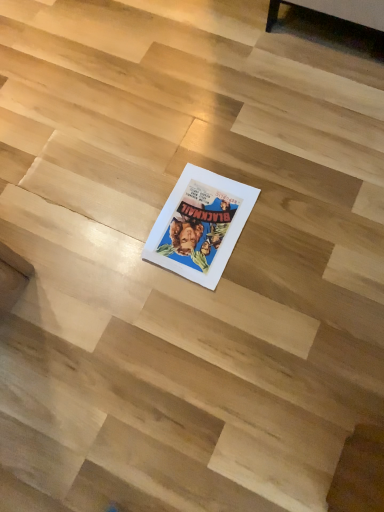
Locate an element on the screen. This screenshot has height=512, width=384. vacant space behind white paper book at center is located at coordinates (190, 154).